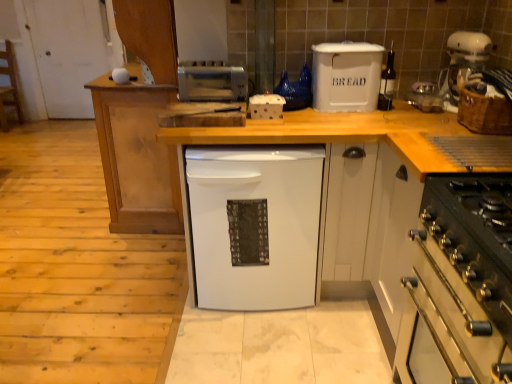
Where is `vacant region to the left of matte white wine bottle at center, the second appliance when ordered from right to left`? vacant region to the left of matte white wine bottle at center, the second appliance when ordered from right to left is located at coordinates (354, 116).